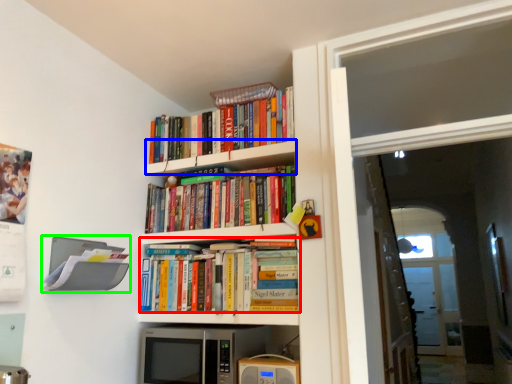
Question: Which is farther away from book (highlighted by a red box)? shelf (highlighted by a blue box) or shelf (highlighted by a green box)?

Choices:
 (A) shelf
 (B) shelf

Answer: (A)